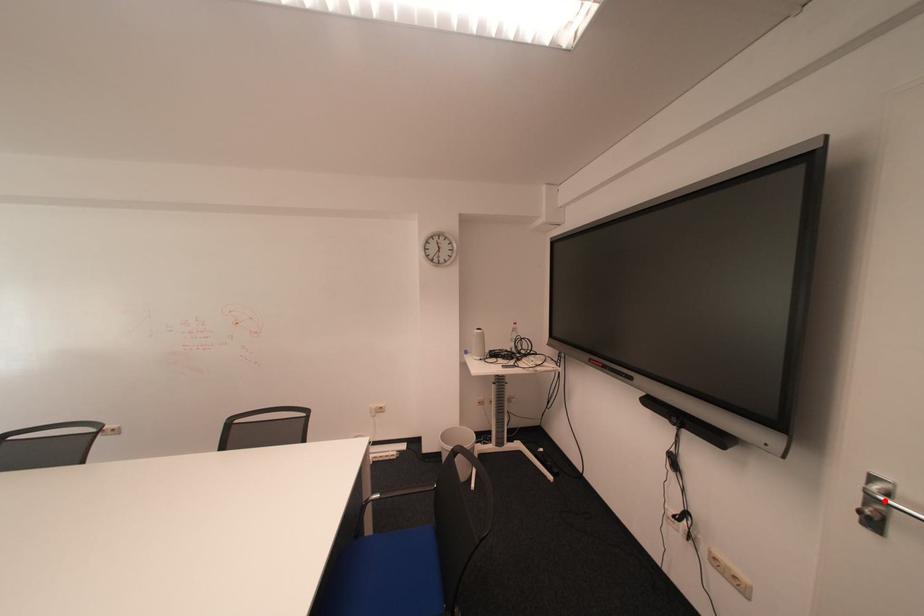
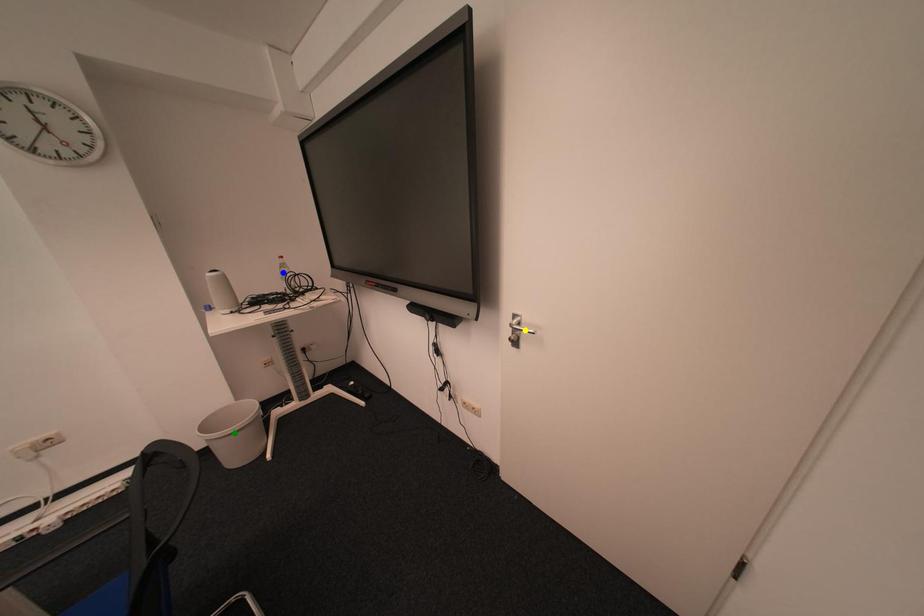
Question: I am providing you with two images of the same scene from different viewpoints. A red point is marked on the first image. You are given multiple points on the second image. Which mark in image 2 goes with the point in image 1?

Choices:
 (A) yellow point
 (B) blue point
 (C) green point

Answer: (A)